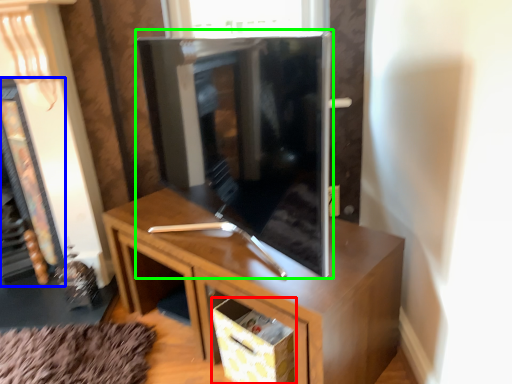
Question: Considering the real-world distances, which object is farthest from drawer (highlighted by a red box)? fireplace (highlighted by a blue box) or tv cabinet (highlighted by a green box)?

Choices:
 (A) fireplace
 (B) tv cabinet

Answer: (A)